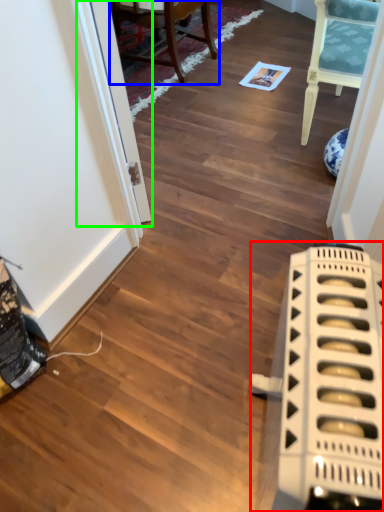
Question: Considering the real-world distances, which object is farthest from appliance (highlighted by a red box)? chair (highlighted by a blue box) or glass door (highlighted by a green box)?

Choices:
 (A) chair
 (B) glass door

Answer: (A)